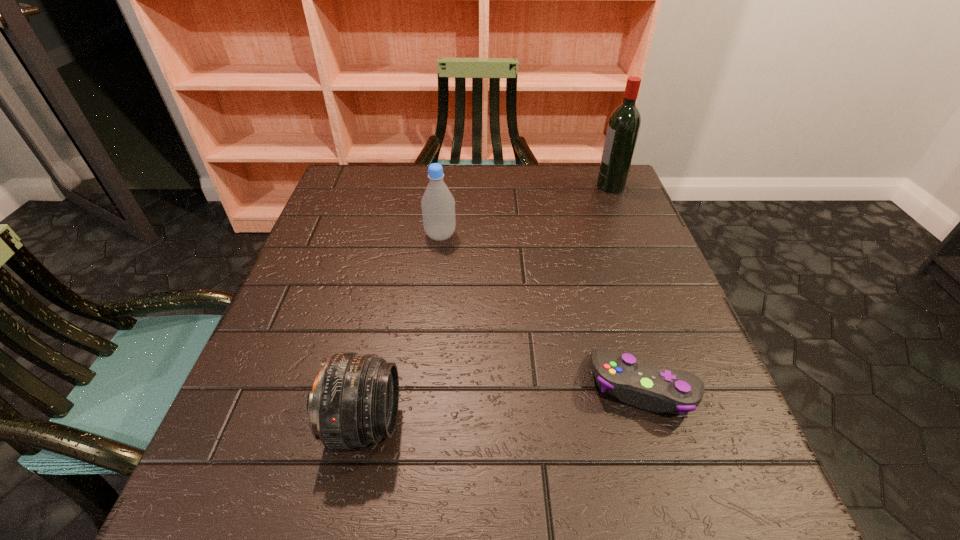
This screenshot has height=540, width=960. In order to click on free spot between the farthest object and the bottle in this screenshot , I will do `click(525, 211)`.

Locate an element on the screen. free space between the tallest object and the second shortest object is located at coordinates (488, 305).

Identify which object is the third closest to the third shortest object. Please provide its 2D coordinates. Your answer should be formatted as a tuple, i.e. [(x, y)], where the tuple contains the x and y coordinates of a point satisfying the conditions above.

[(624, 124)]

Locate which object ranks second in proximity to the shortest object. Please provide its 2D coordinates. Your answer should be formatted as a tuple, i.e. [(x, y)], where the tuple contains the x and y coordinates of a point satisfying the conditions above.

[(438, 204)]